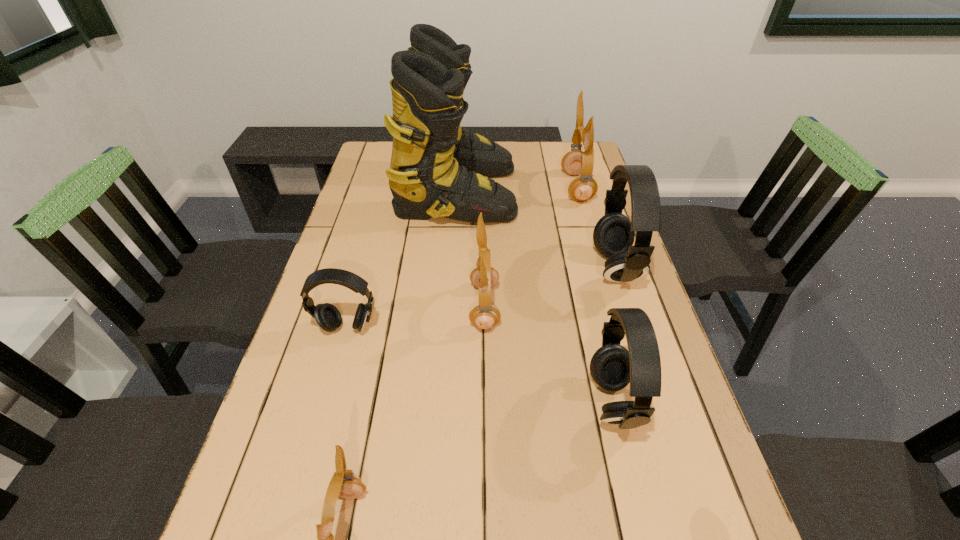
The image size is (960, 540). Find the location of `ski boots`. ski boots is located at coordinates (437, 168).

In order to click on the farthest earphone in this screenshot , I will do `click(583, 188)`.

Image resolution: width=960 pixels, height=540 pixels. Identify the location of the biggest brown earphone. (583, 188).

The height and width of the screenshot is (540, 960). I want to click on the biggest black earphone, so click(x=613, y=236).

The image size is (960, 540). In order to click on the second brown earphone from left to right in this screenshot , I will do `click(485, 315)`.

Identify the location of the second nearest brown earphone. The height and width of the screenshot is (540, 960). pyautogui.click(x=485, y=315).

Locate an element on the screen. the second nearest earphone is located at coordinates (612, 367).

Find the location of a particular element. the second smallest black earphone is located at coordinates (612, 367).

Locate an element on the screen. The width and height of the screenshot is (960, 540). the smallest black earphone is located at coordinates point(327,316).

Find the location of a particular element. The width and height of the screenshot is (960, 540). the leftmost black earphone is located at coordinates (327, 316).